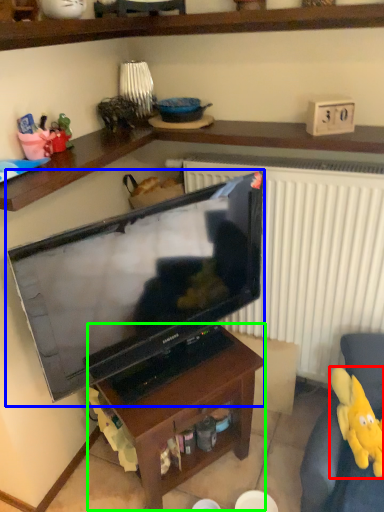
Question: Which object is positioned farthest from toy (highlighted by a red box)? Select from television (highlighted by a blue box) and table (highlighted by a green box).

Choices:
 (A) television
 (B) table

Answer: (A)